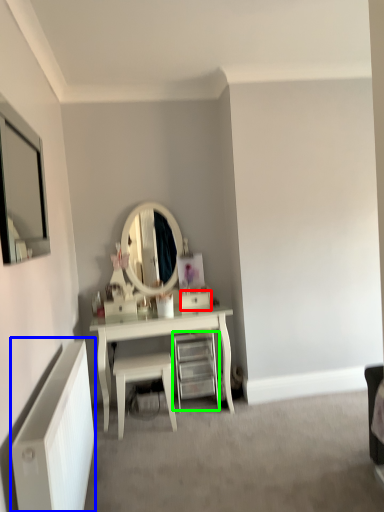
Question: Based on their relative distances, which object is farther from drawer (highlighted by a red box)? Choose from radiator (highlighted by a blue box) and shelf (highlighted by a green box).

Choices:
 (A) radiator
 (B) shelf

Answer: (A)